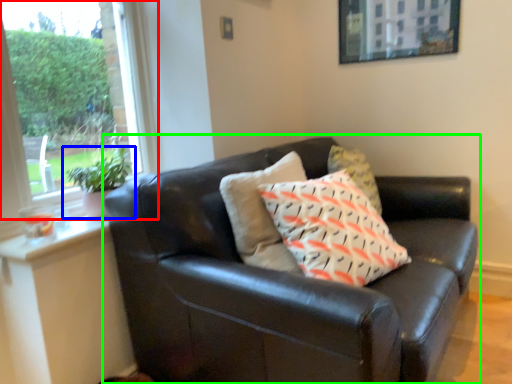
Question: Based on their relative distances, which object is farther from window (highlighted by a red box)? Choose from houseplant (highlighted by a blue box) and studio couch (highlighted by a green box).

Choices:
 (A) houseplant
 (B) studio couch

Answer: (B)